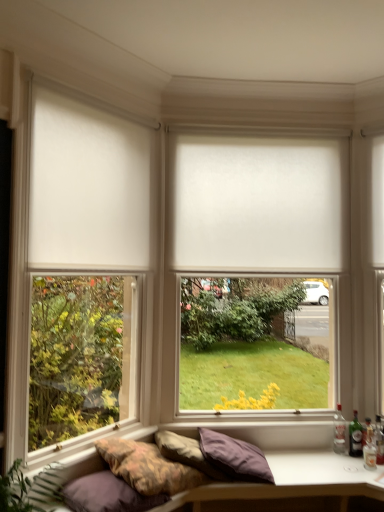
Find the location of a particular element. free space above white matte window frame at upper left (from a real-world perspective) is located at coordinates (86, 71).